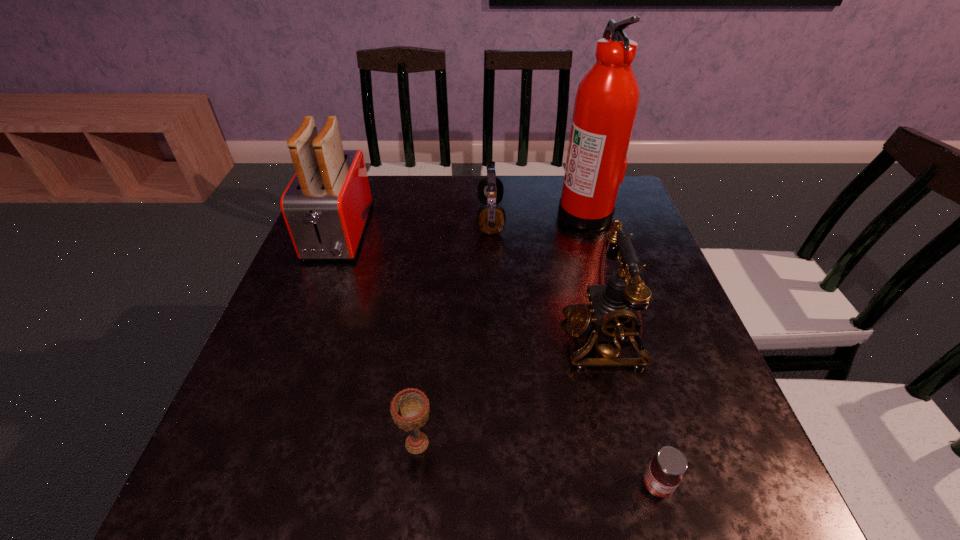
What are the coordinates of `the shortest object` in the screenshot? It's located at (663, 475).

At what (x,y) coordinates should I click in order to perform the action: click on vacant area located on the label side of the fire extinguisher. Please return your answer as a coordinate pair (x, y). Looking at the image, I should click on (498, 213).

This screenshot has height=540, width=960. Identify the location of free space located on the label side of the fire extinguisher. (449, 213).

Locate an element on the screen. Image resolution: width=960 pixels, height=540 pixels. free space located 0.080m on the label side of the fire extinguisher is located at coordinates (529, 213).

In order to click on free spot located 0.090m on the front-facing side of the toaster in this screenshot , I will do `click(314, 295)`.

This screenshot has height=540, width=960. I want to click on free space located 0.330m on the front of the third nearest object, featuring the rotary dial, so click(407, 339).

This screenshot has width=960, height=540. I want to click on vacant space situated on the front of the third nearest object, featuring the rotary dial, so click(x=473, y=339).

Where is `vacant space positioned 0.330m on the front of the third nearest object, featuring the rotary dial`? The width and height of the screenshot is (960, 540). vacant space positioned 0.330m on the front of the third nearest object, featuring the rotary dial is located at coordinates (407, 339).

At what (x,y) coordinates should I click in order to perform the action: click on vacant area situated 0.150m on the ear cups of the third shortest object. Please return your answer as a coordinate pair (x, y). Looking at the image, I should click on (423, 218).

This screenshot has height=540, width=960. Find the location of `vacant space located 0.220m on the ear cups of the third shortest object`. vacant space located 0.220m on the ear cups of the third shortest object is located at coordinates (399, 218).